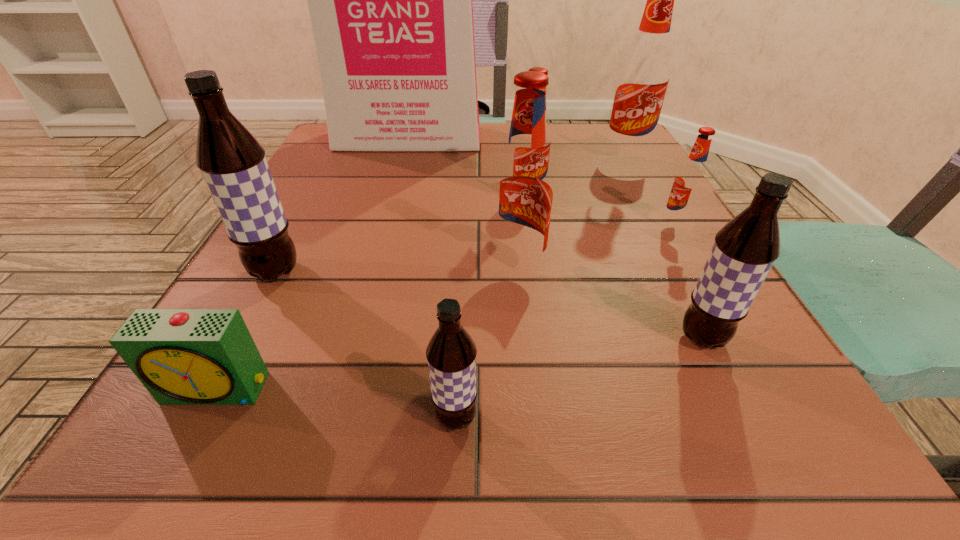
Identify the location of vacant area at the far right corner. (591, 141).

Find the location of a particular element. free space at the near right corner of the desktop is located at coordinates (721, 423).

In order to click on vacant space in between the leftmost brown root beer and the nearest red root beer in this screenshot , I will do `click(396, 272)`.

I want to click on empty space between the eighth shortest object and the alarm clock, so click(x=421, y=273).

At what (x,y) coordinates should I click in order to perform the action: click on empty space that is in between the nearest red root beer and the shopping bag. Please return your answer as a coordinate pair (x, y). Looking at the image, I should click on point(464,205).

Locate an element on the screen. The image size is (960, 540). vacant area that lies between the nearest brown root beer and the fifth nearest root beer is located at coordinates (565, 321).

Image resolution: width=960 pixels, height=540 pixels. I want to click on unoccupied area between the pink shopping bag and the shortest object, so click(x=313, y=264).

Identify the location of free space between the tallest object and the second biggest brown root beer. The height and width of the screenshot is (540, 960). (556, 239).

Find the location of a particular element. Image resolution: width=960 pixels, height=540 pixels. free space between the biggest brown root beer and the sixth root beer from right to left is located at coordinates (366, 345).

Where is `object that is the seventh closest to the third nearest red root beer`? object that is the seventh closest to the third nearest red root beer is located at coordinates (451, 353).